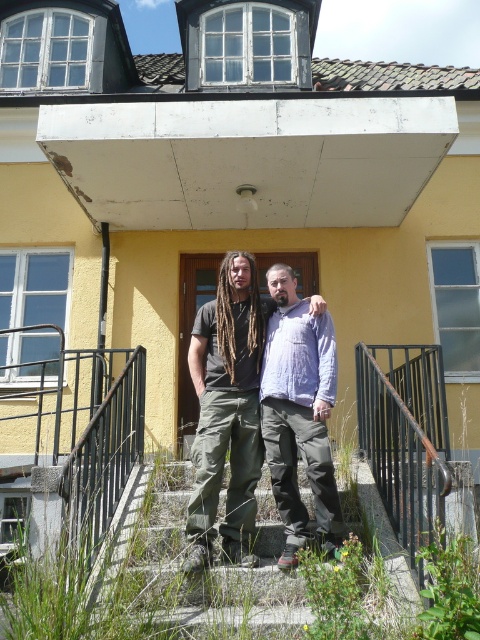
Can you confirm if light purple cotton shirt at center is smaller than brown dreadlocks at center?

Actually, light purple cotton shirt at center might be larger than brown dreadlocks at center.

Can you confirm if light purple cotton shirt at center is taller than brown dreadlocks at center?

Yes.

Between point (310, 344) and point (252, 305), which one is positioned in front?

Point (310, 344)

In order to click on light purple cotton shirt at center in this screenshot , I will do `click(299, 413)`.

Is point (250, 589) less distant than point (295, 317)?

Yes, point (250, 589) is in front of point (295, 317).

Between concrete stairs at center and light purple cotton shirt at center, which one appears on the left side from the viewer's perspective?

concrete stairs at center is more to the left.

Describe the element at coordinates (180, 568) in the screenshot. The height and width of the screenshot is (640, 480). I see `concrete stairs at center` at that location.

Locate an element on the screen. The width and height of the screenshot is (480, 640). concrete stairs at center is located at coordinates (180, 568).

Is concrete stairs at center above brown dreadlocks at center?

No.

Find the location of a particular element. concrete stairs at center is located at coordinates (180, 568).

Where is `concrete stairs at center`? The width and height of the screenshot is (480, 640). concrete stairs at center is located at coordinates (180, 568).